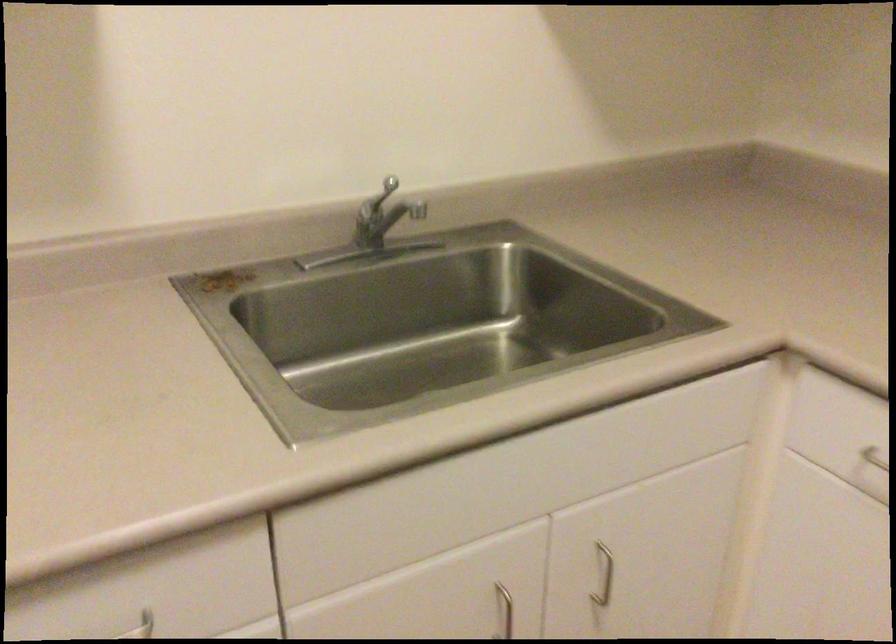
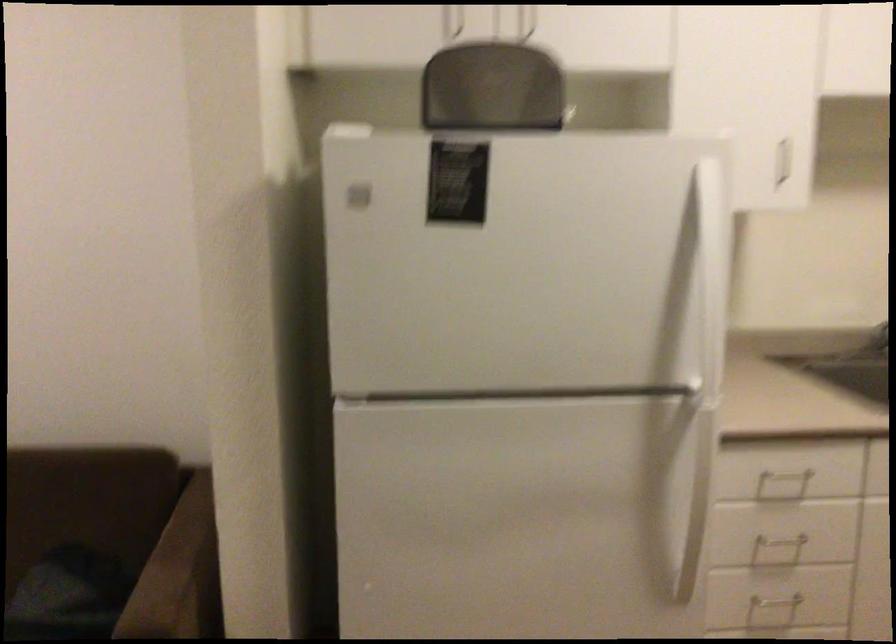
Question: Which direction would the cameraman need to move to produce the second image? Reply with the corresponding letter.

Choices:
 (A) Left
 (B) Right
 (C) Forward
 (D) Backward

Answer: (D)